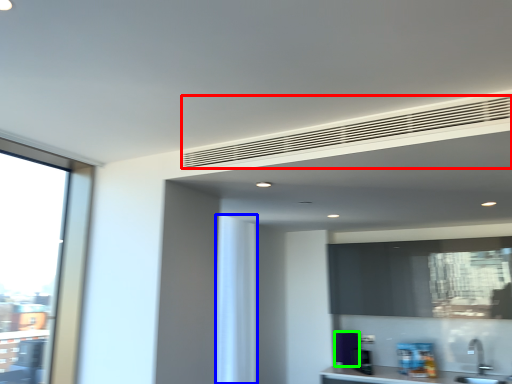
Question: Which object is the farthest from blind (highlighted by a red box)? Choose among these: curtain (highlighted by a blue box) or appliance (highlighted by a green box).

Choices:
 (A) curtain
 (B) appliance

Answer: (B)